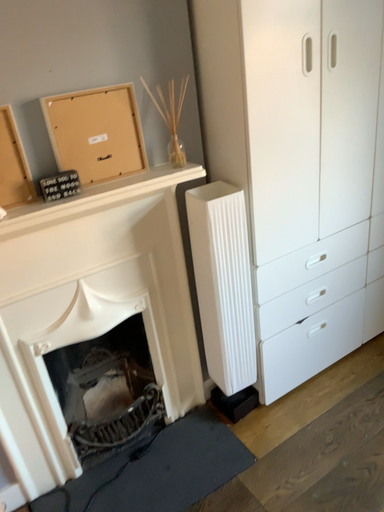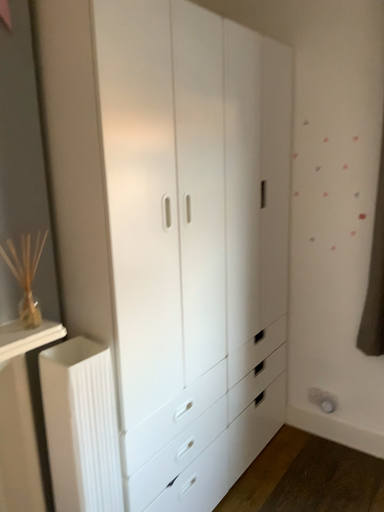
Question: Which way did the camera rotate in the video?

Choices:
 (A) rotated downward
 (B) rotated upward

Answer: (B)